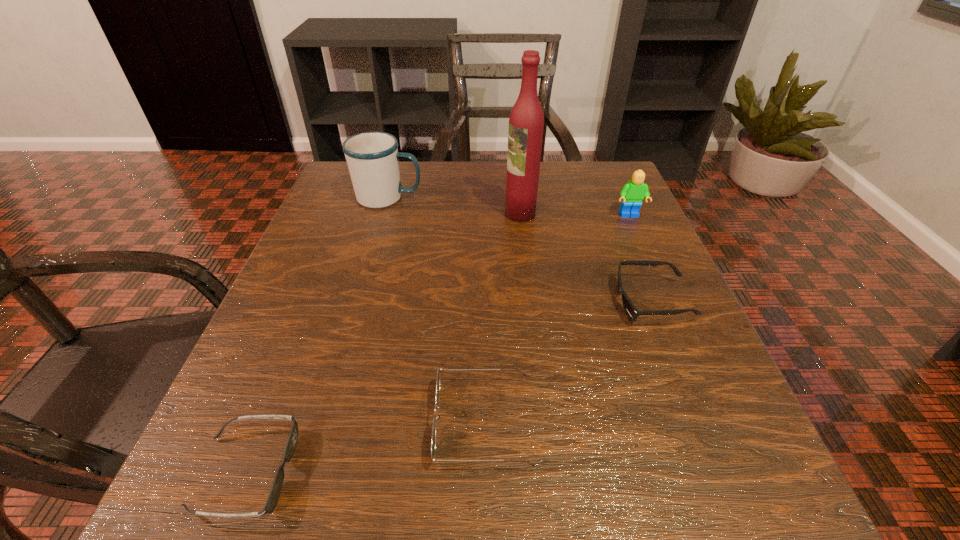
Locate an element on the screen. The height and width of the screenshot is (540, 960). liquor that is positioned at the far edge is located at coordinates (526, 122).

In order to click on mug located at the far edge in this screenshot , I will do `click(372, 157)`.

Locate an element on the screen. This screenshot has width=960, height=540. Lego at the far edge is located at coordinates (632, 194).

Where is `mug at the left edge`? The image size is (960, 540). mug at the left edge is located at coordinates (372, 157).

The image size is (960, 540). I want to click on sunglasses that is at the left edge, so click(273, 497).

Identify the location of Lego located at the right edge. (632, 194).

The height and width of the screenshot is (540, 960). In order to click on sunglasses located in the right edge section of the desktop in this screenshot , I will do `click(632, 312)`.

This screenshot has height=540, width=960. In order to click on object that is at the far left corner in this screenshot , I will do `click(372, 157)`.

The image size is (960, 540). In order to click on object at the near left corner in this screenshot , I will do `click(273, 497)`.

This screenshot has width=960, height=540. What are the coordinates of `object that is at the far right corner` in the screenshot? It's located at (632, 194).